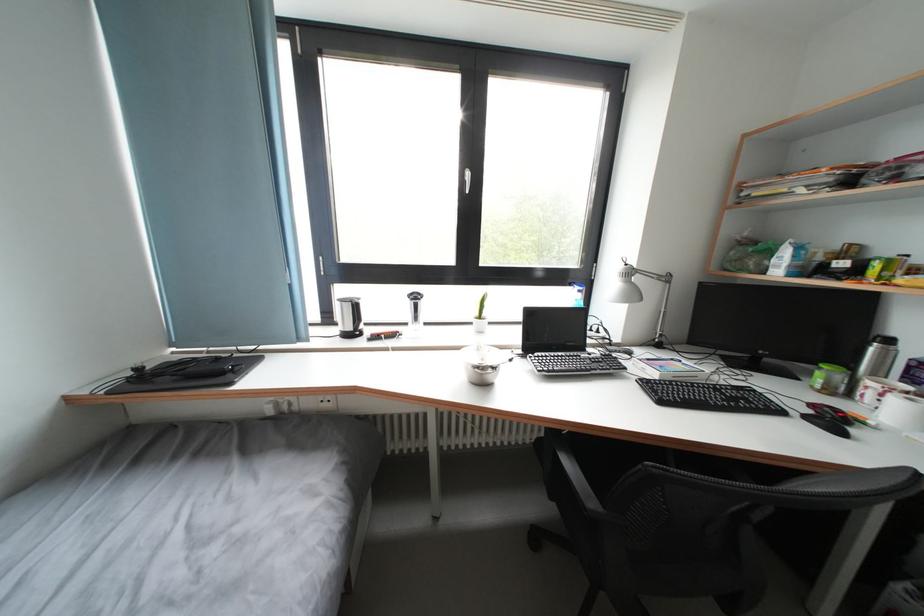
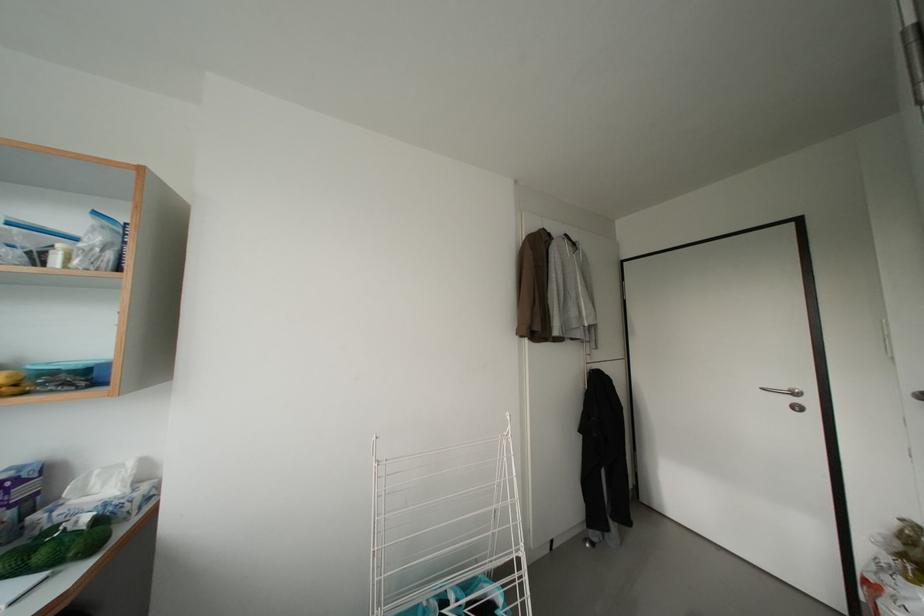
Question: How did the camera likely rotate?

Choices:
 (A) Left
 (B) Right
 (C) Up
 (D) Down

Answer: (B)